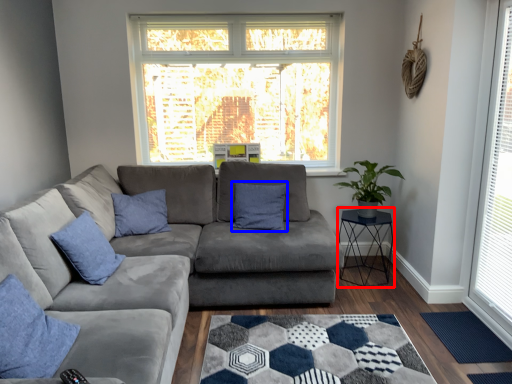
Question: Which object appears closest to the camera in this image, cocktail table (highlighted by a red box) or pillow (highlighted by a blue box)?

Choices:
 (A) cocktail table
 (B) pillow

Answer: (A)